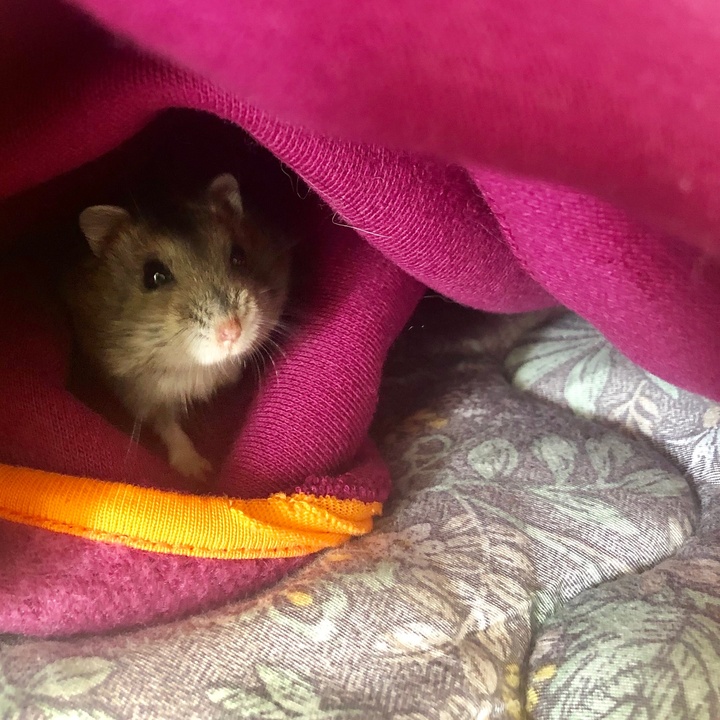
The height and width of the screenshot is (720, 720). I want to click on dark pink blanket, so click(x=319, y=415).